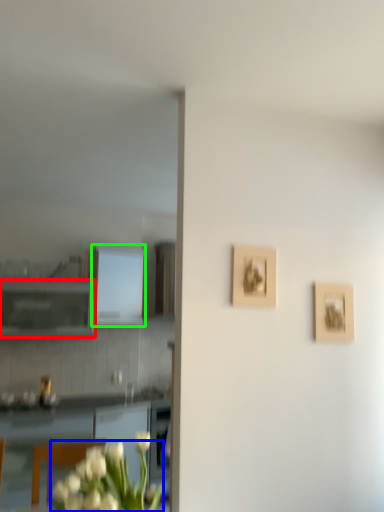
Question: Which object is positioned closest to cabinetry (highlighted by a red box)? Select from flower (highlighted by a blue box) and cabinetry (highlighted by a green box).

Choices:
 (A) flower
 (B) cabinetry

Answer: (B)